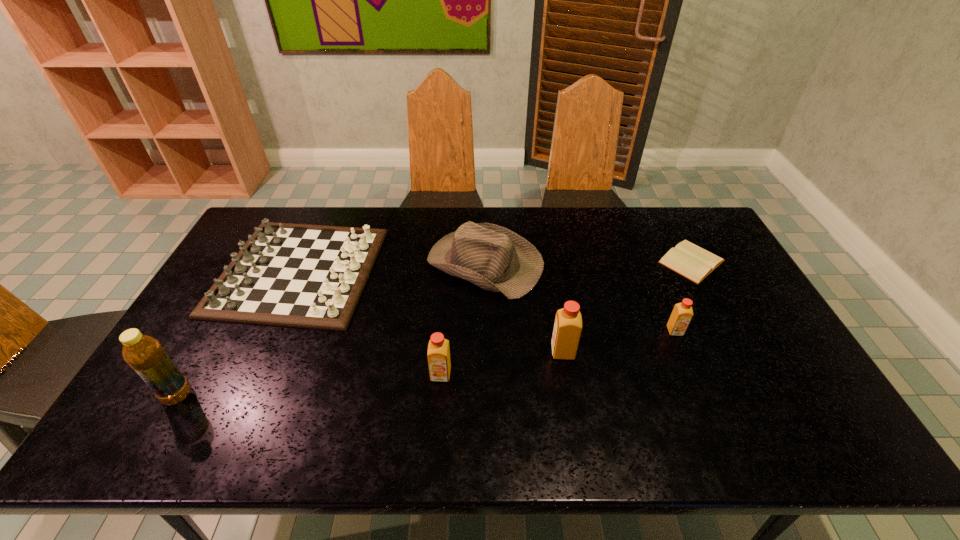
The image size is (960, 540). I want to click on object that is at the far right corner, so click(689, 260).

In the image, there is a desktop. At what (x,y) coordinates should I click in order to perform the action: click on free space at the far edge. Please return your answer as a coordinate pair (x, y). Looking at the image, I should click on (542, 242).

Find the location of a particular element. This screenshot has width=960, height=540. blank space at the near edge of the desktop is located at coordinates (689, 384).

This screenshot has height=540, width=960. Identify the location of vacant area at the left edge of the desktop. (210, 357).

You are a GUI agent. You are given a task and a screenshot of the screen. Output one action in this format:
    pyautogui.click(x=<x>, y=<y>)
    Task: Click on the unoccupied area between the fedora and the second object from right to left
    
    Given the screenshot: What is the action you would take?
    pyautogui.click(x=580, y=298)

Where is `unoccupied position between the fedora and the sixth tallest object`? The height and width of the screenshot is (540, 960). unoccupied position between the fedora and the sixth tallest object is located at coordinates (392, 268).

Find the location of `free space between the bottle and the fifth farthest object`. free space between the bottle and the fifth farthest object is located at coordinates (371, 374).

The height and width of the screenshot is (540, 960). I want to click on empty space between the bottle and the second tallest object, so click(371, 374).

Identify the location of vacant region between the second orange juice from left to right and the second shortest orange juice. This screenshot has width=960, height=540. (502, 363).

This screenshot has height=540, width=960. In order to click on free area in between the fedora and the diary in this screenshot , I will do `click(588, 263)`.